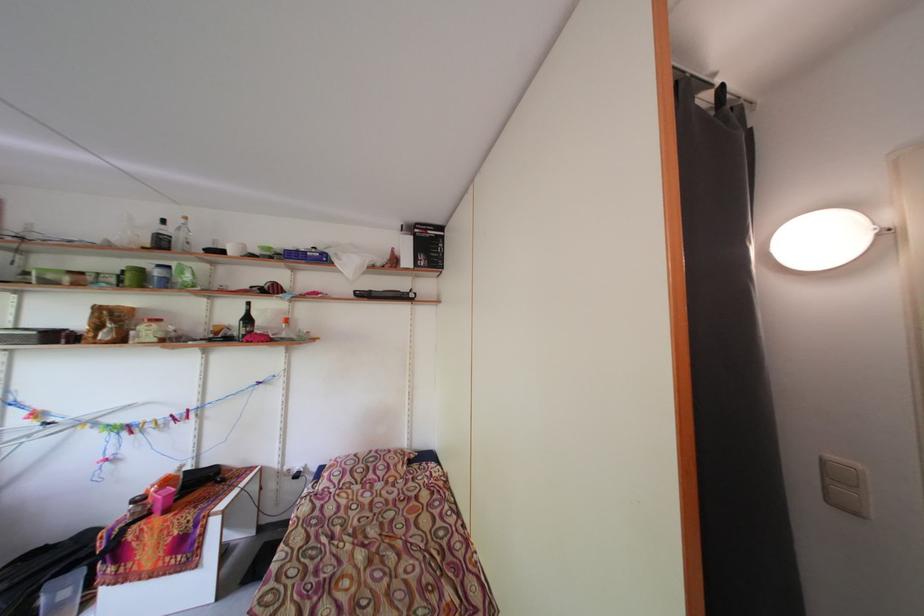
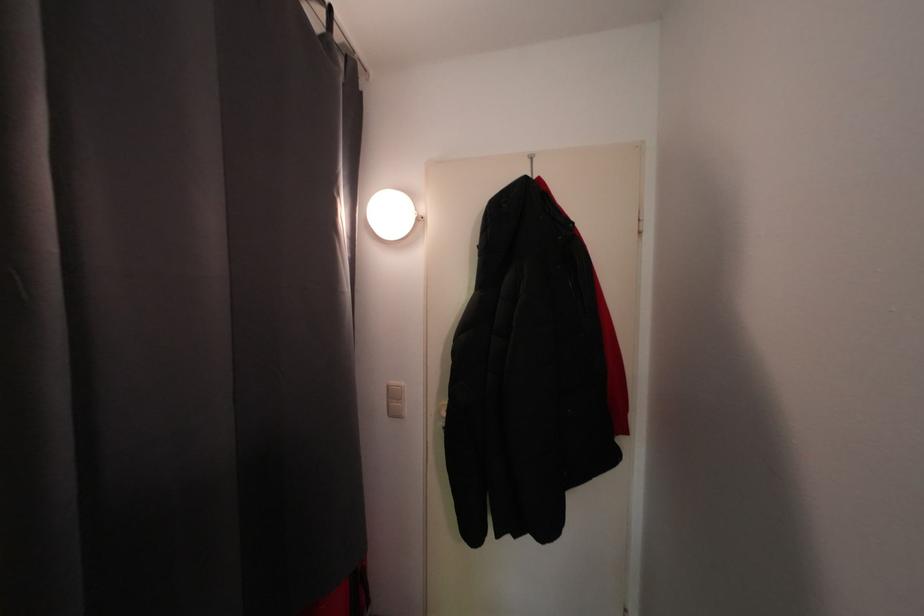
Question: The first image is from the beginning of the video and the second image is from the end. How did the camera likely rotate when shooting the video?

Choices:
 (A) Left
 (B) Right
 (C) Up
 (D) Down

Answer: (B)